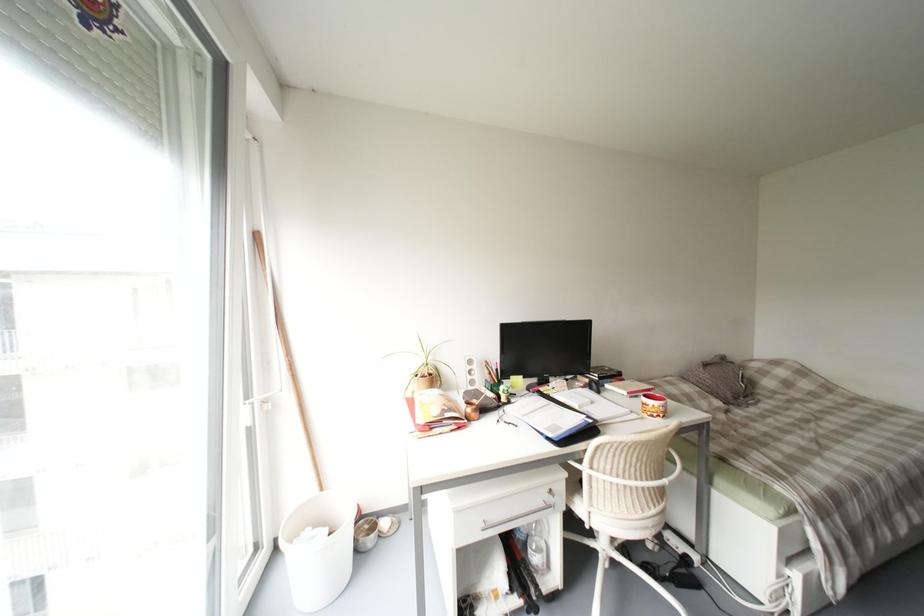
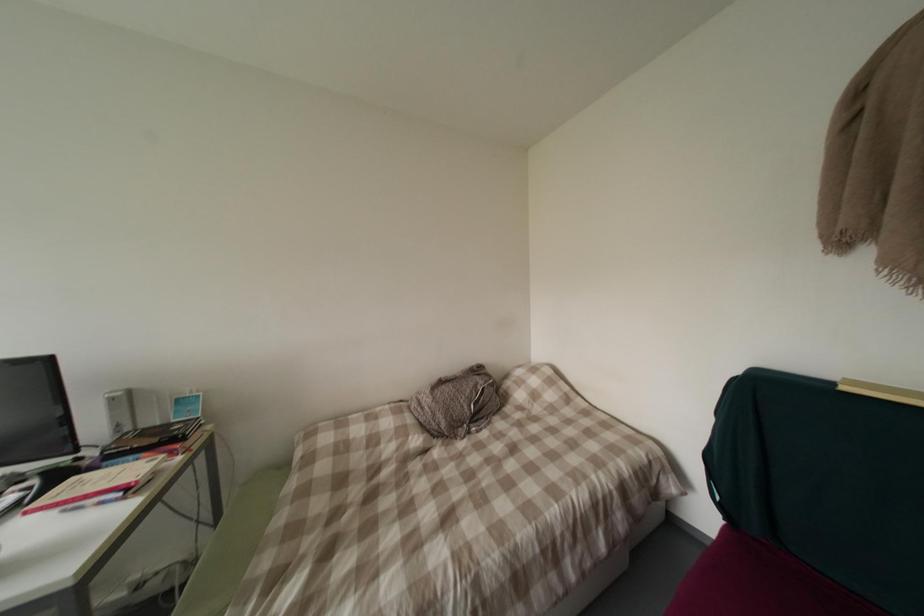
Question: What movement of the cameraman would produce the second image?

Choices:
 (A) Left
 (B) Right
 (C) Forward
 (D) Backward

Answer: (B)